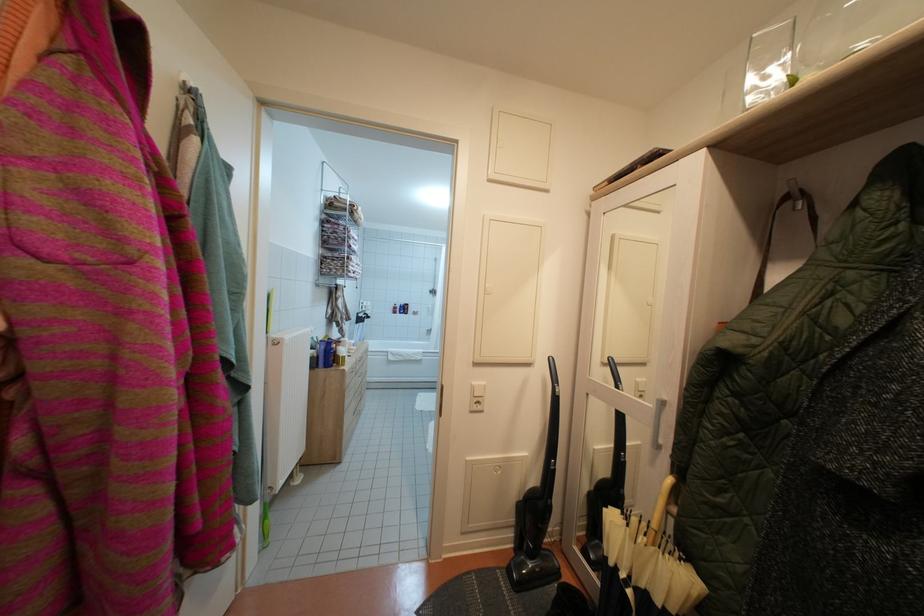
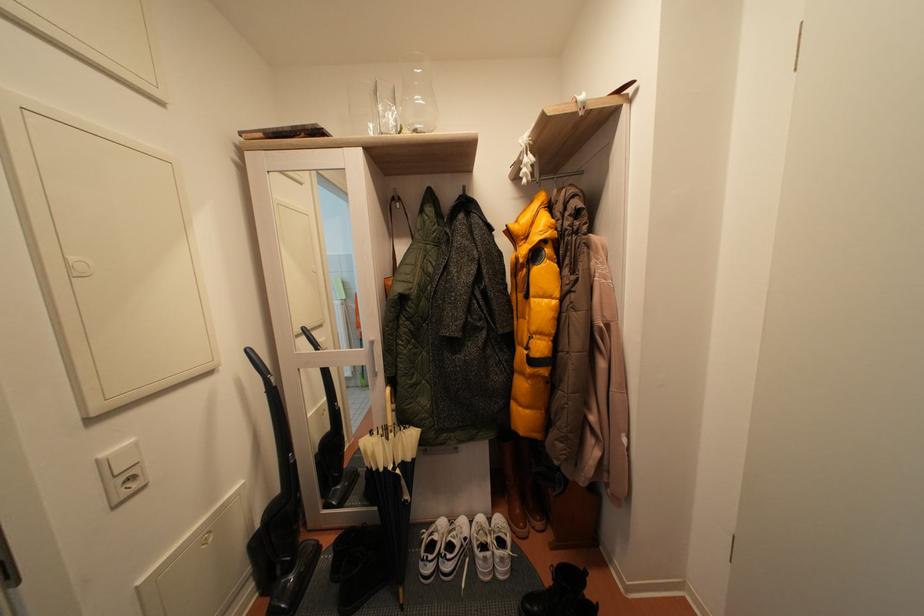
In the second image, find the point that corresponds to pixel 651 530 in the first image.

(387, 437)